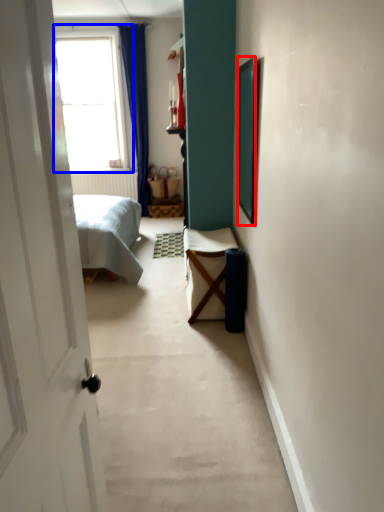
Question: Which object appears farthest to the camera in this image, picture frame (highlighted by a red box) or window (highlighted by a blue box)?

Choices:
 (A) picture frame
 (B) window

Answer: (B)